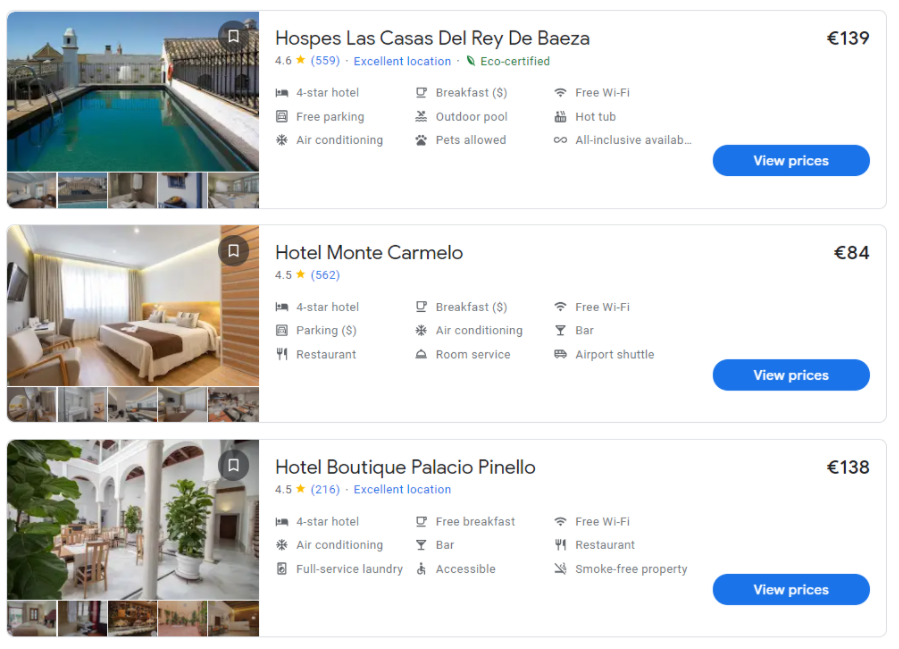
Where is `columns`? This screenshot has height=649, width=899. columns is located at coordinates (114, 472).